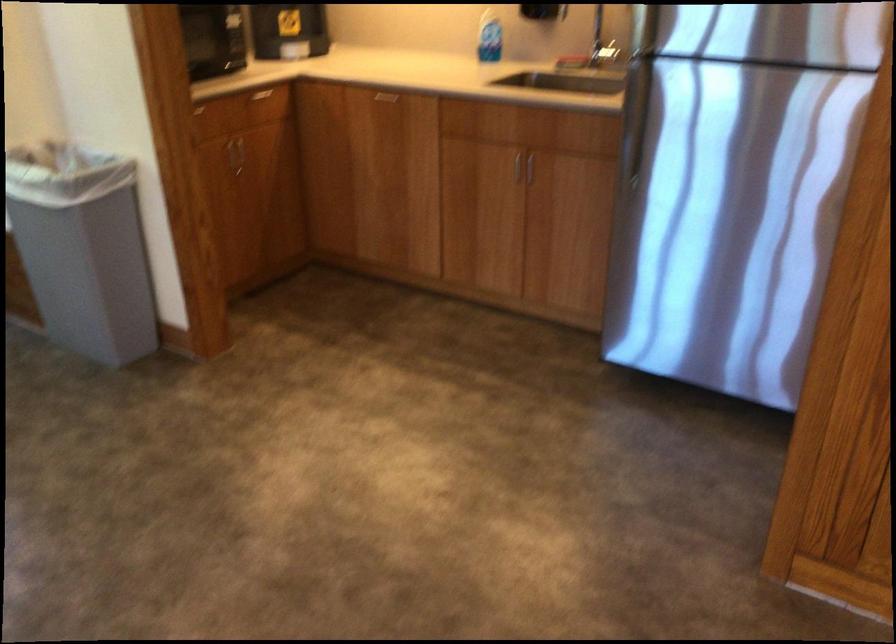
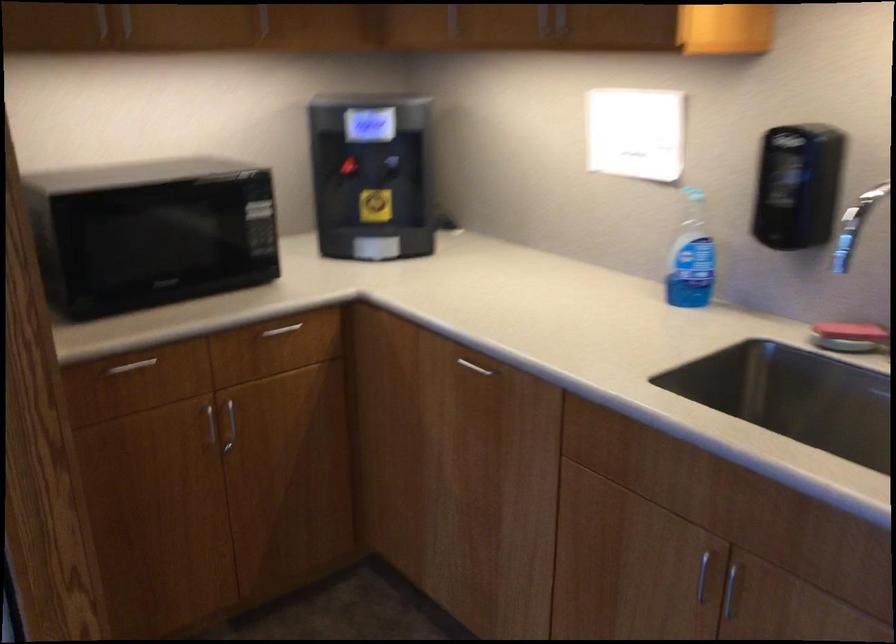
Question: I am providing you with two images of the same scene from different viewpoints. Please identify which objects are invisible in image2.

Choices:
 (A) red water cooler lever
 (B) microwave door button
 (C) blue soap bottle
 (D) none of these

Answer: (D)